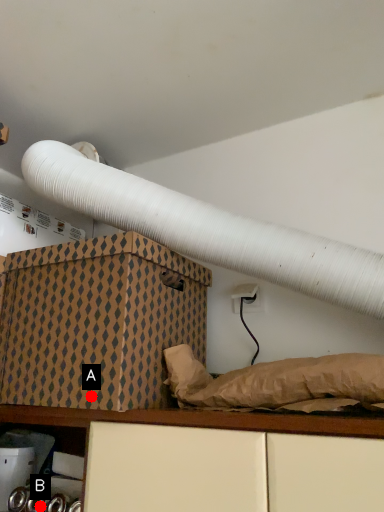
Question: Two points are circled on the image, labeled by A and B beside each circle. Which point appears closest to the camera in this image?

Choices:
 (A) A is closer
 (B) B is closer

Answer: (A)